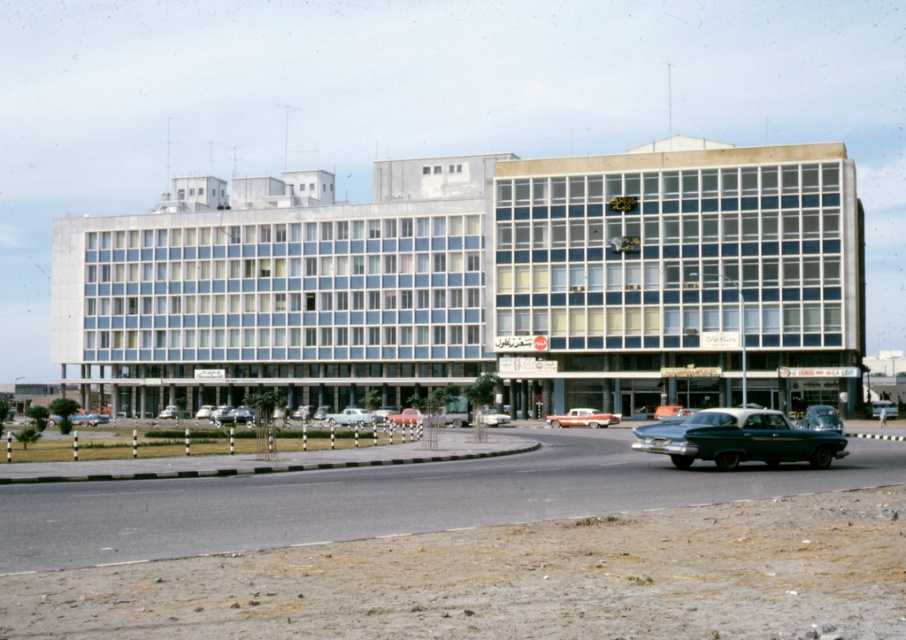
Question: Is shiny teal sedan at center wider than shiny silver sedan at center?

Choices:
 (A) yes
 (B) no

Answer: (B)

Question: Is light blue metallic sedan at center wider than matte black sedan at center?

Choices:
 (A) yes
 (B) no

Answer: (B)

Question: Is shiny teal sedan at center to the right of shiny orange car at center from the viewer's perspective?

Choices:
 (A) no
 (B) yes

Answer: (B)

Question: Which of the following is the farthest from the observer?

Choices:
 (A) shiny black car at center
 (B) shiny teal sedan at center
 (C) light blue metallic sedan at center
 (D) matte red car at center

Answer: (D)

Question: Which point is farther to the camera?

Choices:
 (A) (185, 412)
 (B) (827, 404)
 (C) (326, 416)

Answer: (A)

Question: Which is farther from the orange metallic car at center?

Choices:
 (A) matte red car at center
 (B) shiny silver sedan at center
 (C) shiny orange car at center

Answer: (A)